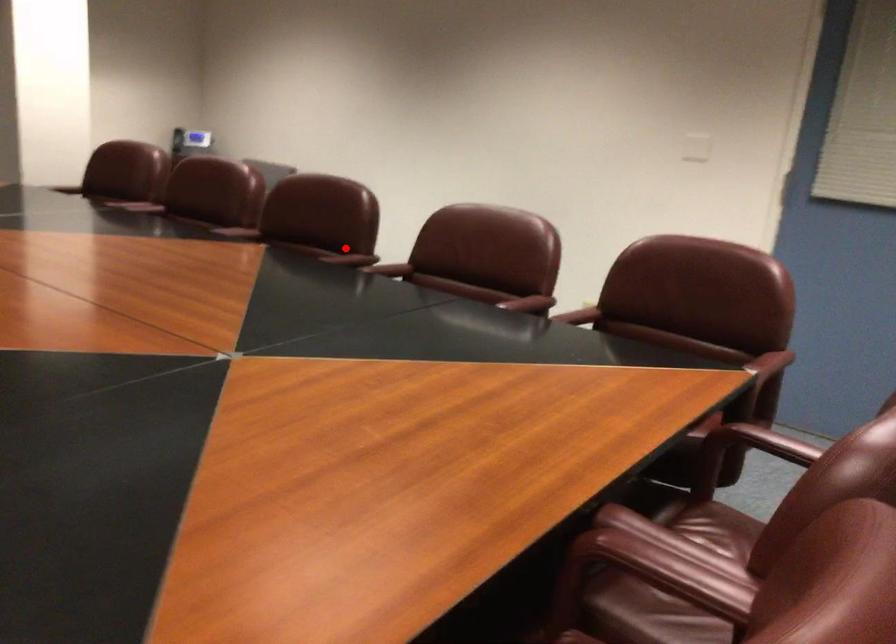
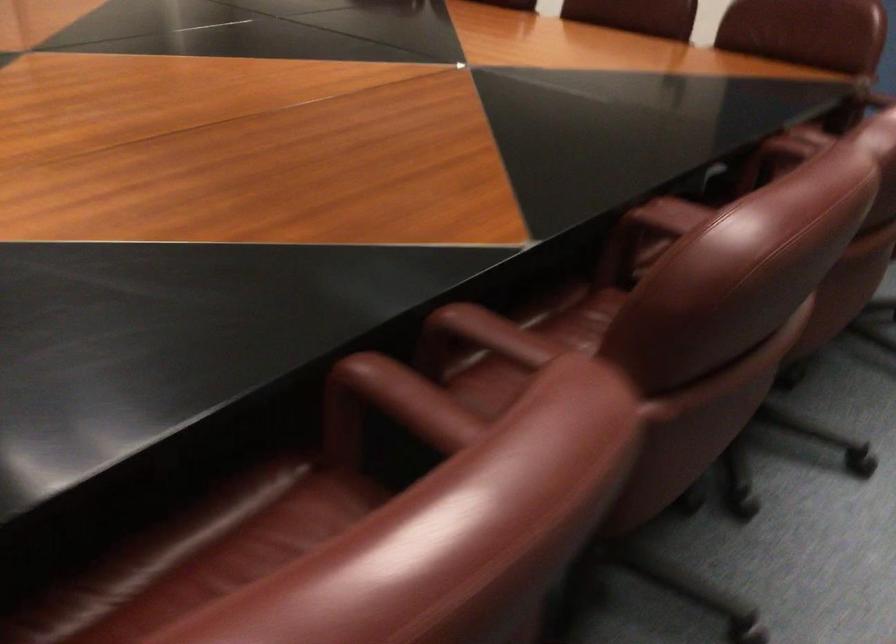
The point at the highlighted location is marked in the first image. Where is the corresponding point in the second image?

(528, 344)